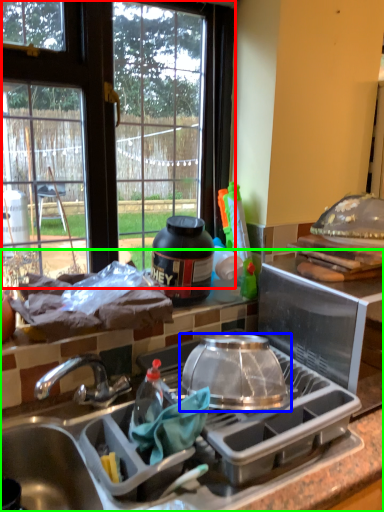
Question: Which object is positioned closest to window (highlighted by a red box)? Select from kitchen appliance (highlighted by a blue box) and countertop (highlighted by a green box).

Choices:
 (A) kitchen appliance
 (B) countertop

Answer: (B)